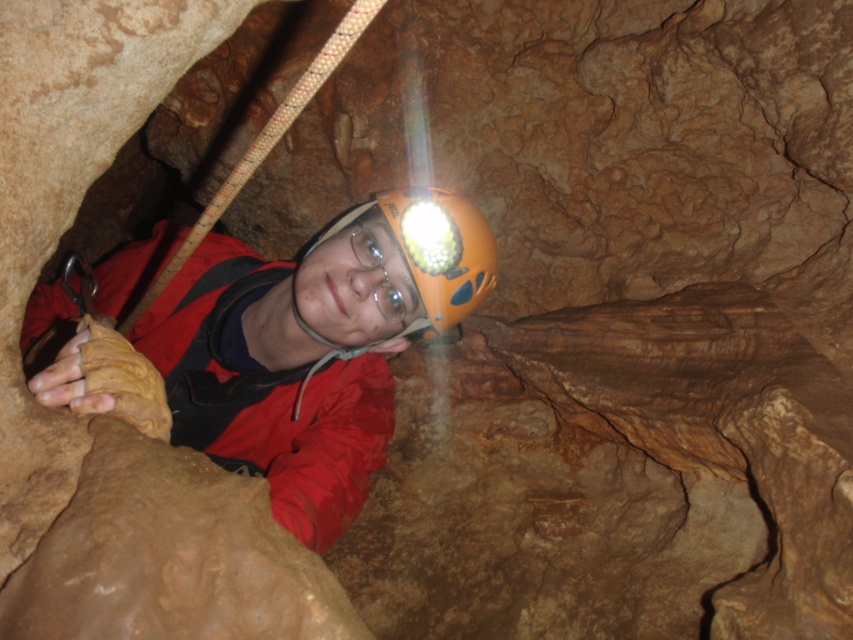
Question: Which object appears closest to the camera in this image?

Choices:
 (A) orange matte helmet at center
 (B) matte orange helmet at center

Answer: (B)

Question: Is matte orange helmet at center bigger than orange matte helmet at center?

Choices:
 (A) no
 (B) yes

Answer: (B)

Question: Is matte orange helmet at center wider than orange matte helmet at center?

Choices:
 (A) no
 (B) yes

Answer: (B)

Question: Which of the following is the closest to the observer?

Choices:
 (A) matte orange helmet at center
 (B) orange matte helmet at center

Answer: (A)

Question: Can you confirm if matte orange helmet at center is wider than orange matte helmet at center?

Choices:
 (A) yes
 (B) no

Answer: (A)